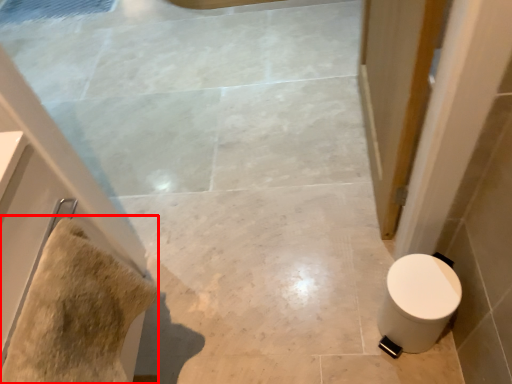
Question: Where is material (annotated by the red box) located in relation to toilet in the image?

Choices:
 (A) right
 (B) left

Answer: (B)